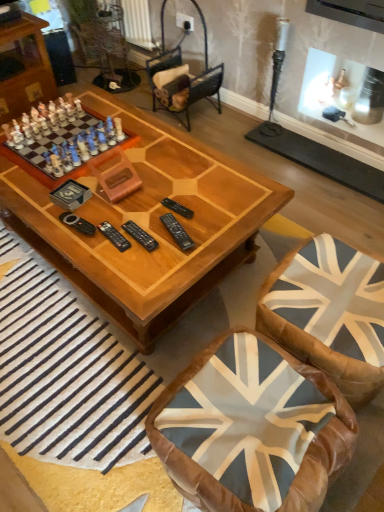
Question: Is black plastic remote at center a part of porcelain chess set at left?

Choices:
 (A) no
 (B) yes

Answer: (A)

Question: Does porcelain chess set at left have a lesser height compared to black plastic remote at center?

Choices:
 (A) no
 (B) yes

Answer: (B)

Question: Does porcelain chess set at left appear on the left side of black plastic remote at center?

Choices:
 (A) yes
 (B) no

Answer: (A)

Question: Is porcelain chess set at left closer to the viewer compared to black plastic remote at center?

Choices:
 (A) no
 (B) yes

Answer: (A)

Question: Is porcelain chess set at left further to camera compared to black plastic remote at center?

Choices:
 (A) yes
 (B) no

Answer: (A)

Question: Is porcelain chess set at left looking in the opposite direction of black plastic remote at center?

Choices:
 (A) yes
 (B) no

Answer: (B)

Question: Could you tell me if blue fabric swivel chair at lower right is turned towards velvet brown armchair at center?

Choices:
 (A) yes
 (B) no

Answer: (B)

Question: Is there a large distance between blue fabric swivel chair at lower right and velvet brown armchair at center?

Choices:
 (A) no
 (B) yes

Answer: (B)

Question: Is blue fabric swivel chair at lower right shorter than velvet brown armchair at center?

Choices:
 (A) no
 (B) yes

Answer: (A)

Question: Can velvet brown armchair at center be found inside blue fabric swivel chair at lower right?

Choices:
 (A) yes
 (B) no

Answer: (B)

Question: Can you confirm if blue fabric swivel chair at lower right is thinner than velvet brown armchair at center?

Choices:
 (A) no
 (B) yes

Answer: (A)

Question: From a real-world perspective, is blue fabric swivel chair at lower right beneath velvet brown armchair at center?

Choices:
 (A) yes
 (B) no

Answer: (A)

Question: Is porcelain chess set at left to the left of velvet brown armchair at center from the viewer's perspective?

Choices:
 (A) yes
 (B) no

Answer: (A)